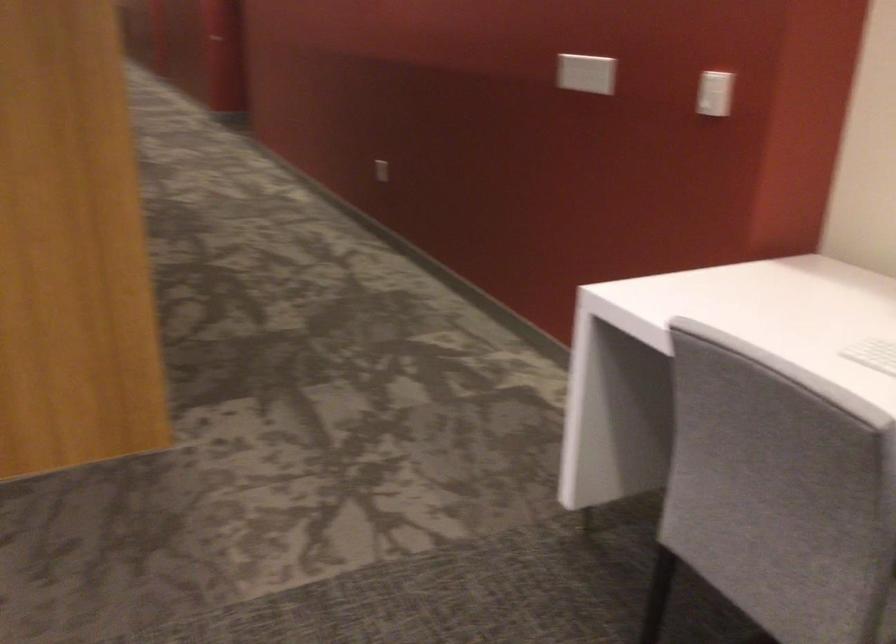
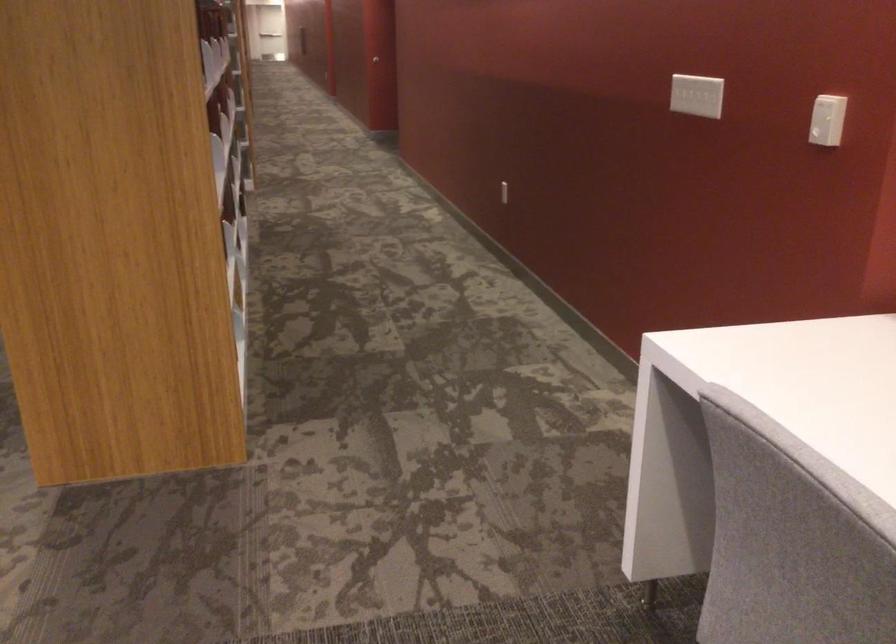
Question: The camera is either moving clockwise (left) or counter-clockwise (right) around the object. The first image is from the beginning of the video and the second image is from the end. Is the camera moving left or right when shooting the video?

Choices:
 (A) Left
 (B) Right

Answer: (B)